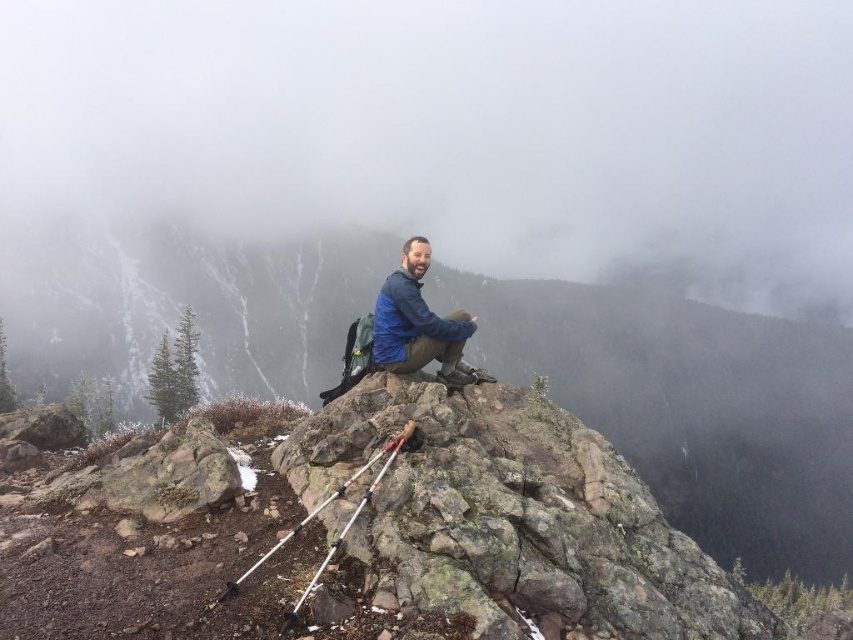
Between white fog at upper center and blue softshell jacket at center, which one is positioned higher?

white fog at upper center

Looking at this image, is white fog at upper center to the left of blue softshell jacket at center from the viewer's perspective?

Incorrect, white fog at upper center is not on the left side of blue softshell jacket at center.

At what (x,y) coordinates should I click in order to perform the action: click on white fog at upper center. Please return your answer as a coordinate pair (x, y). Image resolution: width=853 pixels, height=640 pixels. Looking at the image, I should click on [x=456, y=129].

At what (x,y) coordinates should I click in order to perform the action: click on white fog at upper center. Please return your answer as a coordinate pair (x, y). Looking at the image, I should click on point(456,129).

The height and width of the screenshot is (640, 853). I want to click on white fog at upper center, so click(456, 129).

The height and width of the screenshot is (640, 853). What do you see at coordinates (456, 129) in the screenshot?
I see `white fog at upper center` at bounding box center [456, 129].

Measure the distance between white fog at upper center and camera.

They are 180.05 meters apart.

Where is `white fog at upper center`? white fog at upper center is located at coordinates (456, 129).

Is the position of rocky at center more distant than that of blue softshell jacket at center?

Yes, it is behind blue softshell jacket at center.

Which is behind, point (357, 296) or point (398, 356)?

The point (357, 296) is more distant.

Between point (71, 276) and point (460, 358), which one is positioned behind?

Point (71, 276)

Identify the location of rocky at center. This screenshot has height=640, width=853. (691, 406).